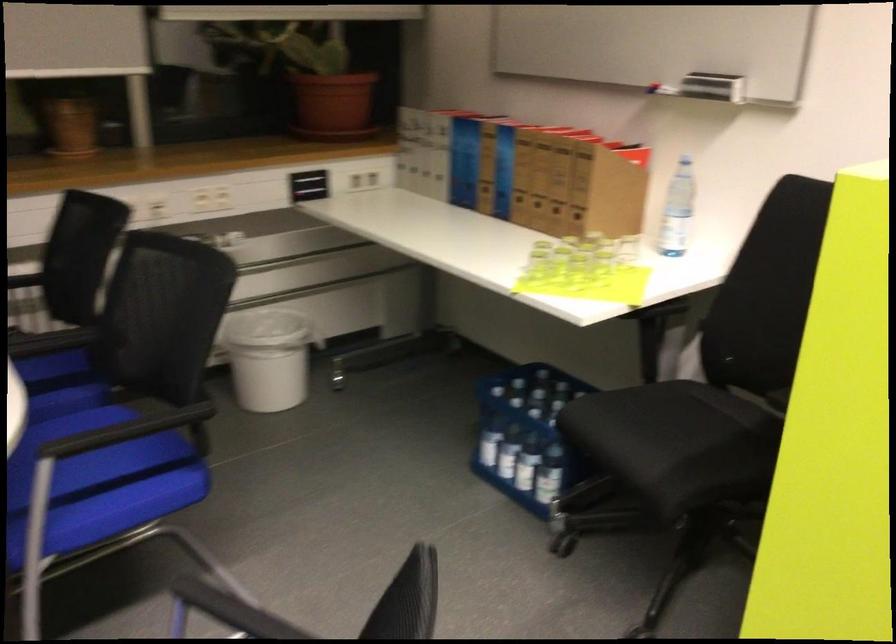
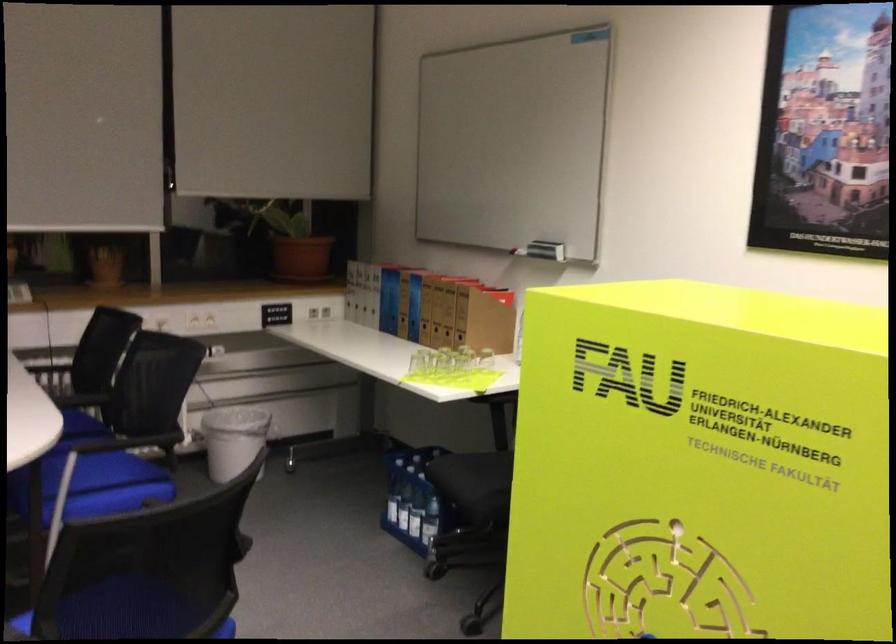
The point at (x=475, y=190) is marked in the first image. Where is the corresponding point in the second image?

(398, 317)